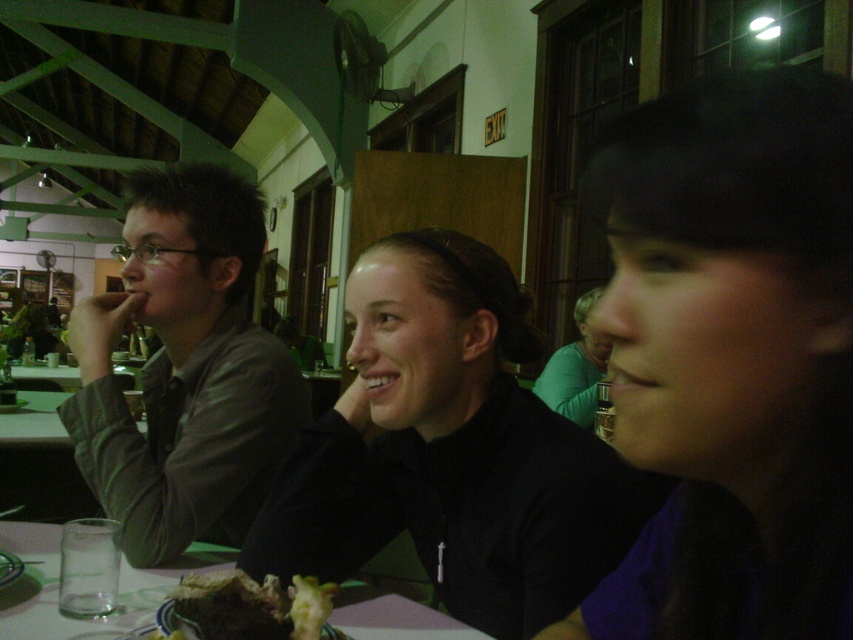
Consider the image. Is matte brown jacket at left above chocolate cake at center?

Yes.

Who is more forward, [125,516] or [300,620]?

Point [300,620]

What are the coordinates of `matte brown jacket at left` in the screenshot? It's located at (184, 369).

Can you confirm if black matte hair at center is positioned to the left of black matte jacket at center?

In fact, black matte hair at center is to the right of black matte jacket at center.

Who is more distant from viewer, (738,141) or (267,564)?

Point (267,564)

You are a GUI agent. You are given a task and a screenshot of the screen. Output one action in this format:
    pyautogui.click(x=<x>, y=<y>)
    Task: Click on the black matte hair at center
    
    Given the screenshot: What is the action you would take?
    pyautogui.click(x=730, y=356)

Is black matte hair at center bigger than chocolate cake at center?

Yes, black matte hair at center is bigger than chocolate cake at center.

The width and height of the screenshot is (853, 640). What do you see at coordinates (730, 356) in the screenshot? I see `black matte hair at center` at bounding box center [730, 356].

Is point (720, 164) farther from viewer compared to point (256, 634)?

No, (720, 164) is closer to viewer.

The height and width of the screenshot is (640, 853). I want to click on black matte hair at center, so click(x=730, y=356).